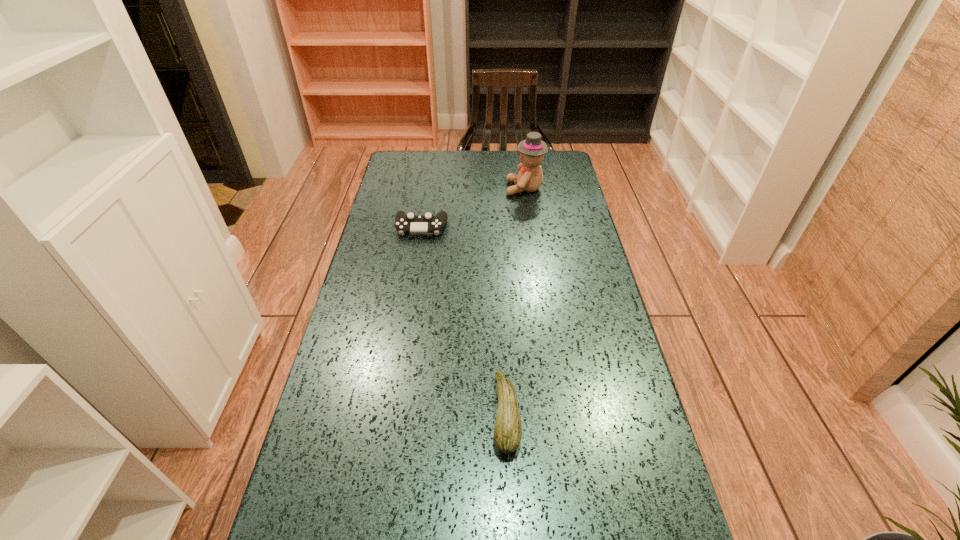
I want to click on free space at the far left corner of the desktop, so click(x=396, y=154).

This screenshot has height=540, width=960. In the image, there is a desktop. What are the coordinates of `vacant space at the far right corner` in the screenshot? It's located at (545, 174).

Identify the location of vacant space that's between the rag_doll and the nearest object. (516, 301).

I want to click on free point between the control and the nearest object, so click(x=464, y=321).

At what (x,y) coordinates should I click in order to perform the action: click on vacant space that's between the nearest object and the leftmost object. Please return your answer as a coordinate pair (x, y). The width and height of the screenshot is (960, 540). Looking at the image, I should click on (464, 321).

You are a GUI agent. You are given a task and a screenshot of the screen. Output one action in this format:
    pyautogui.click(x=<x>, y=<y>)
    Task: Click on the free space between the zucchini and the second farthest object
    The height and width of the screenshot is (540, 960).
    Given the screenshot: What is the action you would take?
    pyautogui.click(x=464, y=321)

Where is `free spot between the zucchini and the farthest object`? free spot between the zucchini and the farthest object is located at coordinates (516, 301).

Image resolution: width=960 pixels, height=540 pixels. What are the coordinates of `unoccupied position between the second nearest object and the nearest object` in the screenshot? It's located at (464, 321).

Choose which object is the second nearest neighbor to the rag_doll. Please provide its 2D coordinates. Your answer should be formatted as a tuple, i.e. [(x, y)], where the tuple contains the x and y coordinates of a point satisfying the conditions above.

[(508, 430)]

Locate an element on the screen. The width and height of the screenshot is (960, 540). object that is the second nearest to the leftmost object is located at coordinates (508, 430).